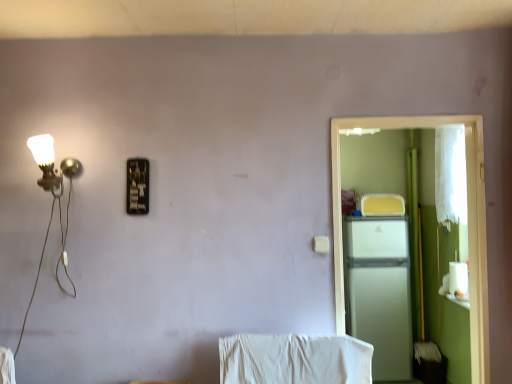
Locate an element on the screen. The width and height of the screenshot is (512, 384). white matte refrigerator at right is located at coordinates (468, 222).

Describe the element at coordinates (468, 222) in the screenshot. I see `white matte refrigerator at right` at that location.

Where is `white matte refrigerator at right`? white matte refrigerator at right is located at coordinates click(380, 292).

The image size is (512, 384). What do you see at coordinates (380, 292) in the screenshot? I see `white matte refrigerator at right` at bounding box center [380, 292].

In order to face white matte refrigerator at right, should I rotate leftwards or rightwards?

A 15.836 degree turn to the right will do.

The height and width of the screenshot is (384, 512). What are the coordinates of `white matte refrigerator at right` in the screenshot? It's located at (468, 222).

Between white matte refrigerator at right and white matte refrigerator at right, which one appears on the left side from the viewer's perspective?

white matte refrigerator at right.

Between white matte refrigerator at right and white matte refrigerator at right, which one is positioned behind?

Positioned behind is white matte refrigerator at right.

Is point (345, 251) closer or farther from the camera than point (434, 117)?

Point (345, 251) appears to be farther away from the viewer than point (434, 117).

From the image's perspective, would you say white matte refrigerator at right is shown under white matte refrigerator at right?

Yes, from the image's perspective, white matte refrigerator at right is beneath white matte refrigerator at right.

From a real-world perspective, is white matte refrigerator at right physically below white matte refrigerator at right?

Correct, in the physical world, white matte refrigerator at right is lower than white matte refrigerator at right.

Is white matte refrigerator at right wider than white matte refrigerator at right?

Indeed, white matte refrigerator at right has a greater width compared to white matte refrigerator at right.

Between white matte refrigerator at right and white matte refrigerator at right, which one has less height?

white matte refrigerator at right is shorter.

Based on their sizes in the image, would you say white matte refrigerator at right is bigger or smaller than white matte refrigerator at right?

white matte refrigerator at right is bigger than white matte refrigerator at right.

Is white matte refrigerator at right located within white matte refrigerator at right?

No, white matte refrigerator at right is not inside white matte refrigerator at right.

Consider the image. Is white matte refrigerator at right next to white matte refrigerator at right and touching it?

No, white matte refrigerator at right is not in contact with white matte refrigerator at right.

Could you tell me if white matte refrigerator at right is facing white matte refrigerator at right?

Yes, white matte refrigerator at right faces towards white matte refrigerator at right.

What's the angular difference between white matte refrigerator at right and white matte refrigerator at right's facing directions?

1.54 degrees separate the facing orientations of white matte refrigerator at right and white matte refrigerator at right.

Measure the distance from white matte refrigerator at right to white matte refrigerator at right.

white matte refrigerator at right is 1.40 meters away from white matte refrigerator at right.

In order to click on screen door that appears above the white matte refrigerator at right (from a real-world perspective) in this screenshot , I will do `click(468, 222)`.

Between white matte refrigerator at right and white matte refrigerator at right, which one appears on the left side from the viewer's perspective?

Positioned to the left is white matte refrigerator at right.

In the image, is white matte refrigerator at right positioned in front of or behind white matte refrigerator at right?

In the image, white matte refrigerator at right appears in front of white matte refrigerator at right.

Which point is more distant from viewer, (472, 282) or (349, 217)?

Positioned behind is point (349, 217).

From the image's perspective, which is above, white matte refrigerator at right or white matte refrigerator at right?

white matte refrigerator at right is shown above in the image.

From a real-world perspective, does white matte refrigerator at right stand above white matte refrigerator at right?

Yes.

Considering the sizes of white matte refrigerator at right and white matte refrigerator at right in the image, is white matte refrigerator at right wider or thinner than white matte refrigerator at right?

Clearly, white matte refrigerator at right has less width compared to white matte refrigerator at right.

Who is shorter, white matte refrigerator at right or white matte refrigerator at right?

white matte refrigerator at right is shorter.

Considering the sizes of white matte refrigerator at right and white matte refrigerator at right in the image, is white matte refrigerator at right bigger or smaller than white matte refrigerator at right?

Considering their sizes, white matte refrigerator at right takes up less space than white matte refrigerator at right.

Is white matte refrigerator at right spatially inside white matte refrigerator at right, or outside of it?

white matte refrigerator at right exists outside the volume of white matte refrigerator at right.

Is the surface of white matte refrigerator at right in direct contact with white matte refrigerator at right?

No.

Based on the photo, does white matte refrigerator at right turn towards white matte refrigerator at right?

No, white matte refrigerator at right is not facing towards white matte refrigerator at right.

Locate an element on the screen. The image size is (512, 384). screen door located on the left of white matte refrigerator at right is located at coordinates (468, 222).

This screenshot has width=512, height=384. I want to click on screen door above the white matte refrigerator at right (from the image's perspective), so click(468, 222).

At what (x,y) coordinates should I click in order to perform the action: click on appliance located behind the white matte refrigerator at right. Please return your answer as a coordinate pair (x, y). The height and width of the screenshot is (384, 512). Looking at the image, I should click on (380, 292).